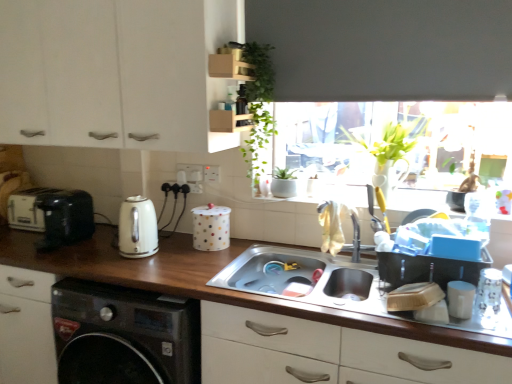
The height and width of the screenshot is (384, 512). Find the location of `vacant region in front of white matte cup at lower right, the 1th appliance positioned from the front`. vacant region in front of white matte cup at lower right, the 1th appliance positioned from the front is located at coordinates (480, 331).